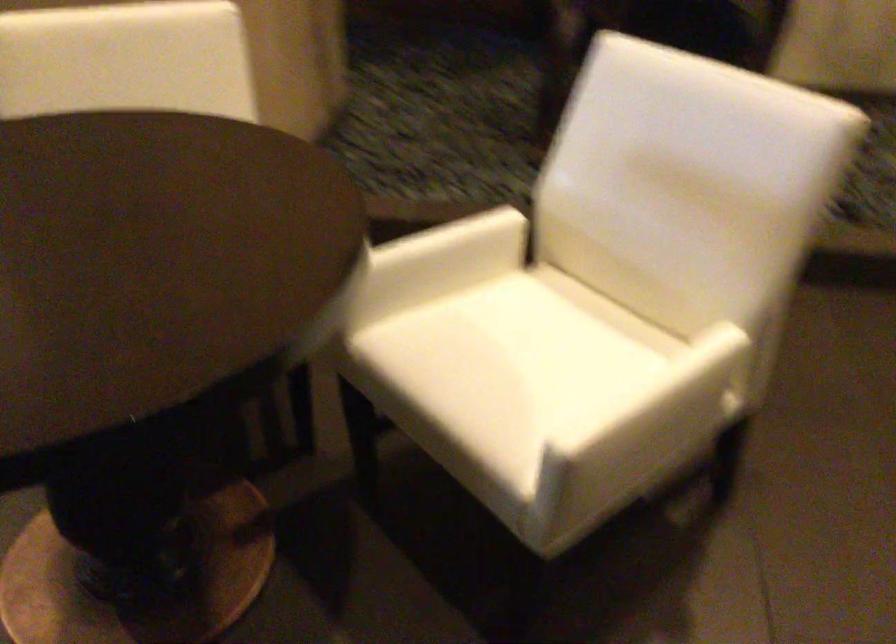
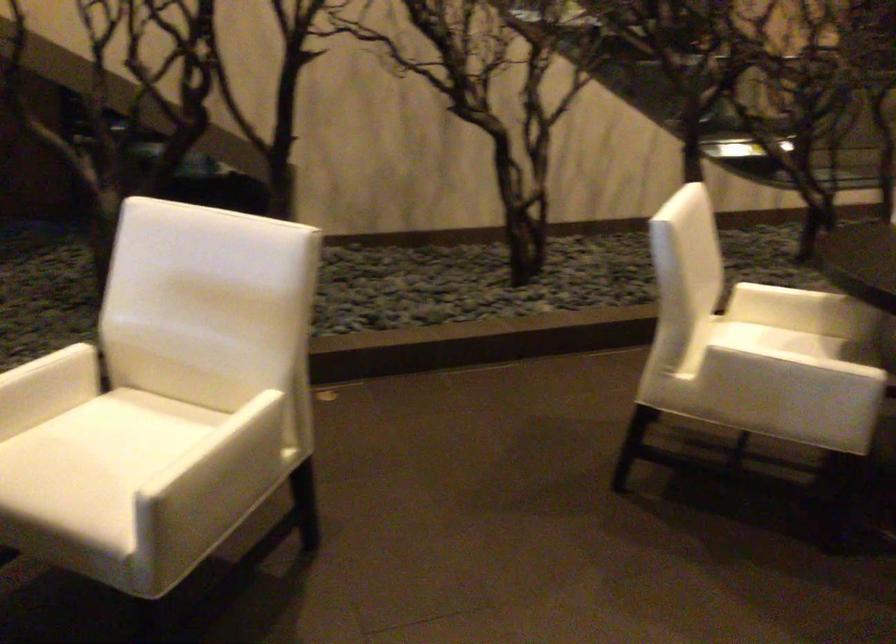
In the second image, find the point that corresponds to (x=661, y=415) in the first image.

(225, 462)